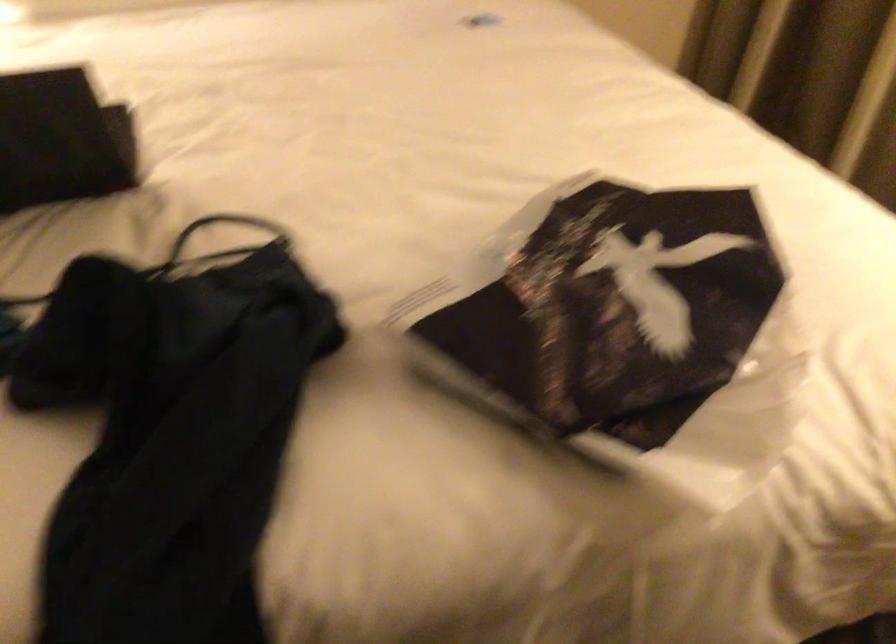
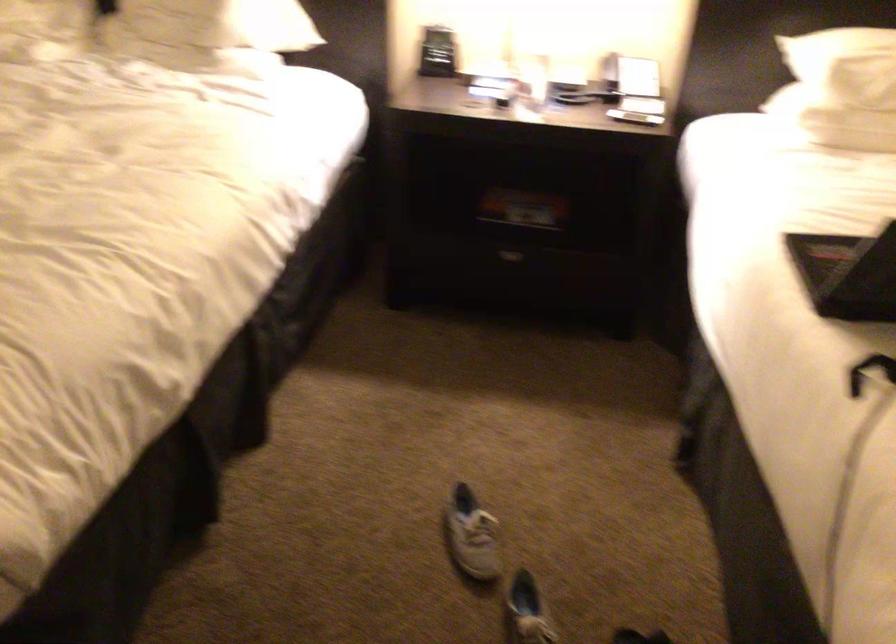
Question: The first image is from the beginning of the video and the second image is from the end. How did the camera likely rotate when shooting the video?

Choices:
 (A) Left
 (B) Right
 (C) Up
 (D) Down

Answer: (A)